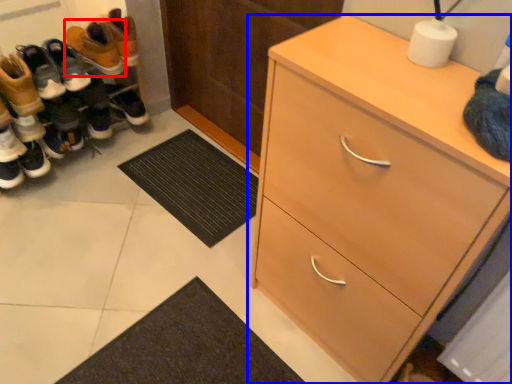
Question: Which point is further to the camera, footwear (highlighted by a red box) or chest of drawers (highlighted by a blue box)?

Choices:
 (A) footwear
 (B) chest of drawers

Answer: (A)